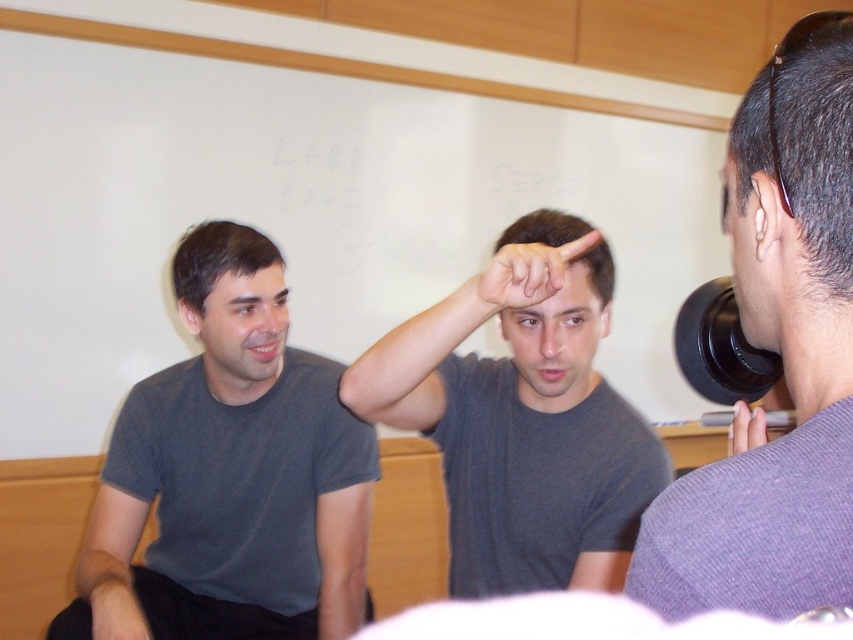
Looking at this image, in the scene, there is a point labeled as point (552, 237). Where exactly is this point located in the image?

The point labeled as point (552, 237) is located on the matte gray hand at center.

You are designing a puppet show and need to ensure the puppet has limbs proportionate to its head. Given the matte gray hand at center and the matte gray ear at left, which object should you use as a reference for the size of the puppet ear?

The matte gray ear at left should be used as the reference for the puppet ear since the matte gray hand at center is wider than the ear, indicating the ear is smaller in size.